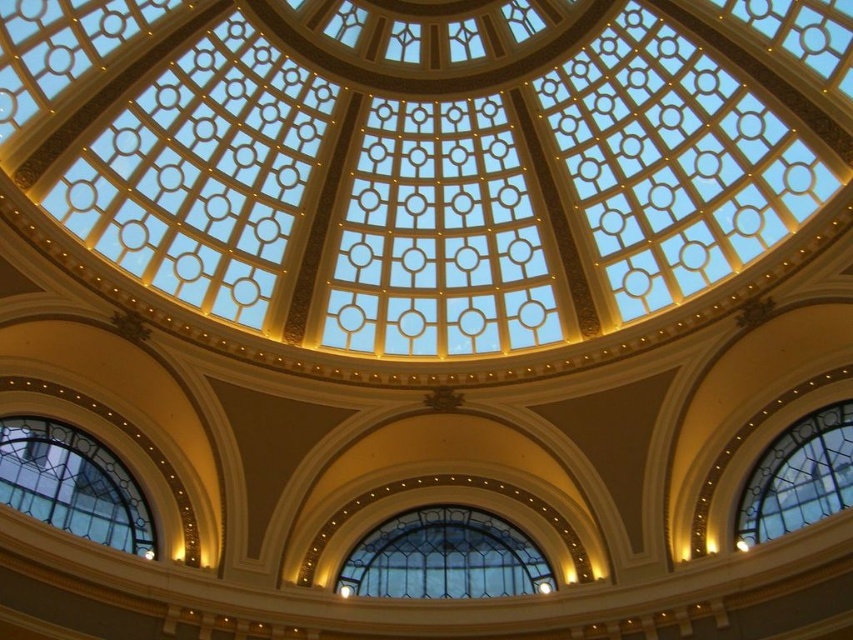
Based on the photo, measure the distance between clear glass window at center and camera.

A distance of 79.49 meters exists between clear glass window at center and camera.

Is clear glass window at center above clear glass window at lower left?

No, clear glass window at center is not above clear glass window at lower left.

Is point (512, 529) positioned in front of point (125, 536)?

That is False.

Find the location of `clear glass window at center`. clear glass window at center is located at coordinates (444, 557).

Can you confirm if clear glass window at center is positioned to the left of clear glass window at lower right?

Correct, you'll find clear glass window at center to the left of clear glass window at lower right.

Find the location of a particular element. The height and width of the screenshot is (640, 853). clear glass window at center is located at coordinates (444, 557).

Does clear glass window at lower left appear over clear glass window at lower right?

No, clear glass window at lower left is not above clear glass window at lower right.

Can you confirm if clear glass window at lower left is shorter than clear glass window at lower right?

No.

Between point (144, 513) and point (811, 451), which one is positioned in front?

Point (811, 451) is in front.

Where is `clear glass window at lower left`? clear glass window at lower left is located at coordinates (73, 483).